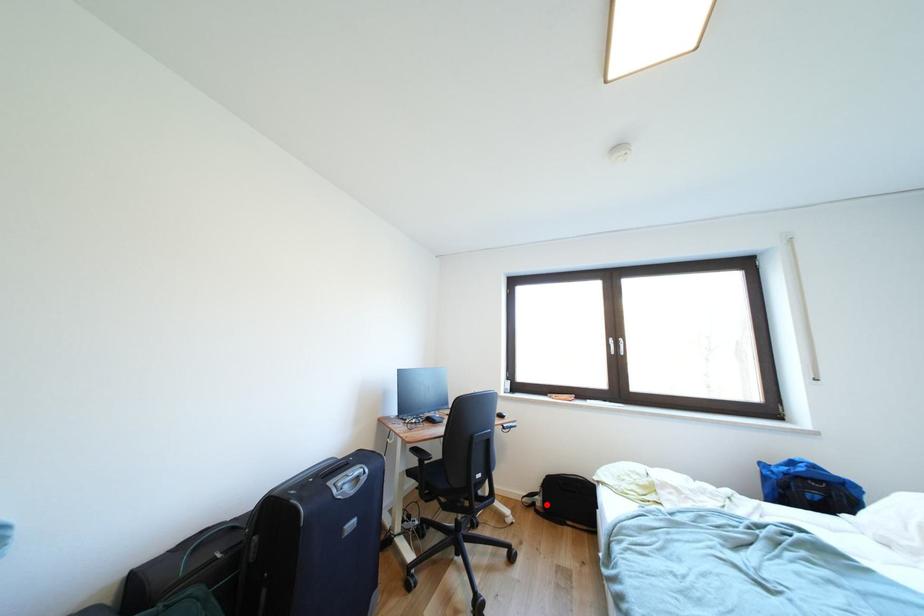
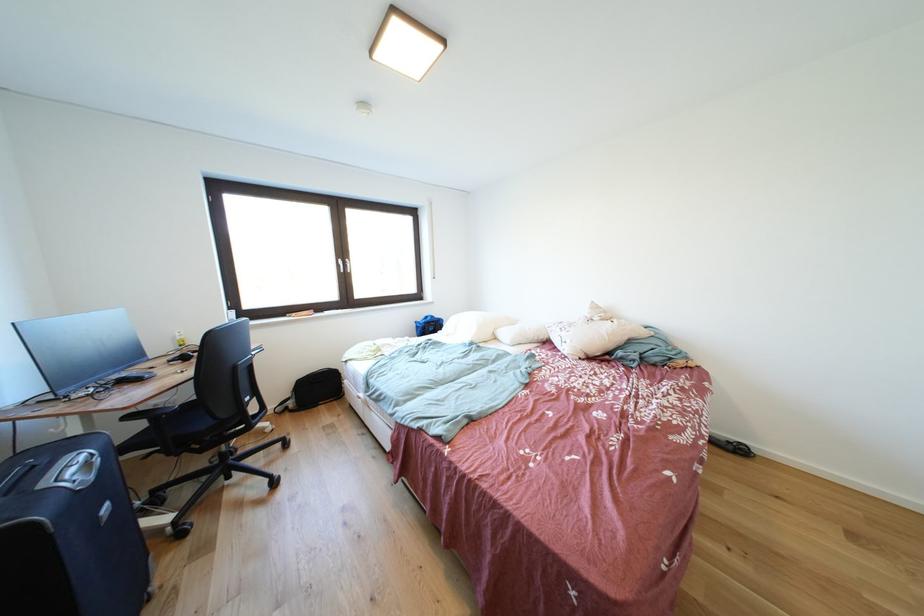
Find the pixel in the second image that matches the highlighted location in the first image.

(299, 408)